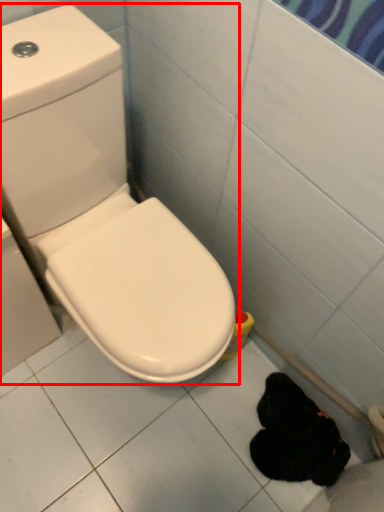
Question: In this image, where is toilet (annotated by the red box) located relative to animal?

Choices:
 (A) left
 (B) right

Answer: (A)